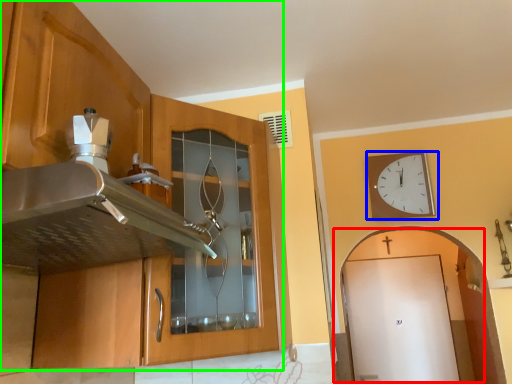
Question: Which object is positioned closest to door (highlighted by a red box)? Select from wall clock (highlighted by a blue box) and cabinetry (highlighted by a green box).

Choices:
 (A) wall clock
 (B) cabinetry

Answer: (A)